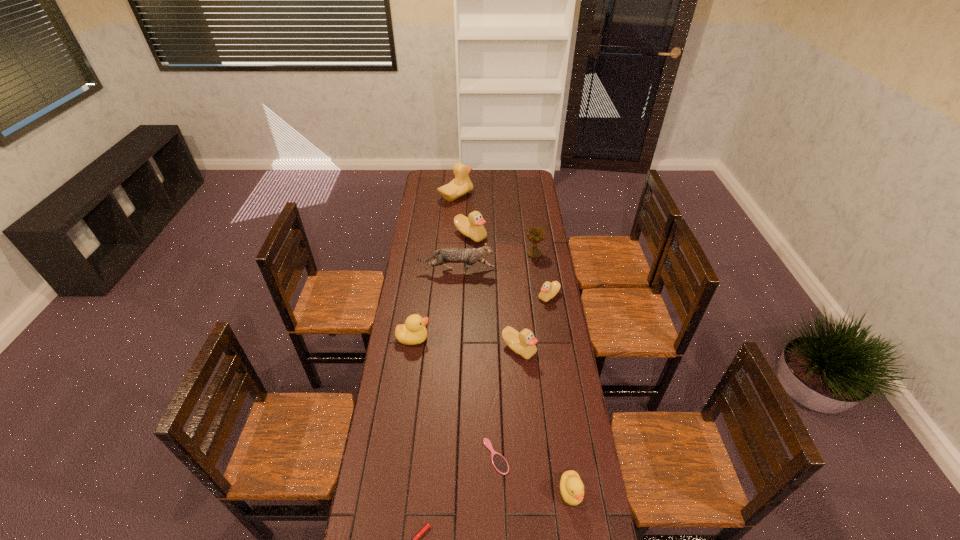
Point out which object is positioned as the fifth nearest to the biggest beige duck. Please provide its 2D coordinates. Your answer should be formatted as a tuple, i.e. [(x, y)], where the tuple contains the x and y coordinates of a point satisfying the conditions above.

[(413, 332)]

Point out which object is positioned as the third nearest to the second smallest beige duck. Please provide its 2D coordinates. Your answer should be formatted as a tuple, i.e. [(x, y)], where the tuple contains the x and y coordinates of a point satisfying the conditions above.

[(499, 462)]

Where is `duck that is the second closest to the second farthest duck`? This screenshot has width=960, height=540. duck that is the second closest to the second farthest duck is located at coordinates (549, 290).

Choose which duck is the fourth nearest neighbor to the nearest object. Please provide its 2D coordinates. Your answer should be formatted as a tuple, i.e. [(x, y)], where the tuple contains the x and y coordinates of a point satisfying the conditions above.

[(549, 290)]

I want to click on beige duck that stands as the closest to the third nearest beige duck, so click(461, 184).

The image size is (960, 540). In order to click on beige duck that is the second closest to the second farthest object in this screenshot , I will do `click(549, 290)`.

In order to click on vacant position in the image that satisfies the following two spatial constraints: 1. at the beak of the farthest beige duck; 2. on the right side of the hairbrush in this screenshot , I will do `click(438, 456)`.

At what (x,y) coordinates should I click in order to perform the action: click on free space that satisfies the following two spatial constraints: 1. at the beak of the fifth nearest duck; 2. on the face of the seventh nearest object. Please return your answer as a coordinate pair (x, y). Looking at the image, I should click on (469, 272).